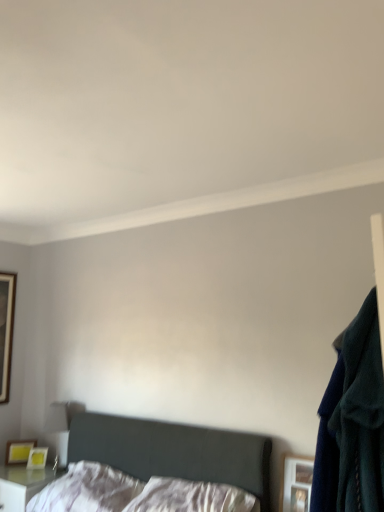
Question: Based on their positions, is white satin pillow at center, arranged as the 1th pillow when viewed from the right, located to the left or right of wooden framed mirror at left, which ranks as the 3th picture frame in bottom-to-top order?

Choices:
 (A) left
 (B) right

Answer: (B)

Question: Considering the positions of white satin pillow at center, arranged as the 1th pillow when viewed from the right, and wooden framed mirror at left, positioned as the first picture frame in left-to-right order, in the image, is white satin pillow at center, arranged as the 1th pillow when viewed from the right, wider or thinner than wooden framed mirror at left, positioned as the first picture frame in left-to-right order,?

Choices:
 (A) thin
 (B) wide

Answer: (B)

Question: Based on their relative distances, which object is nearer to the white glossy nightstand at lower left?

Choices:
 (A) white soft pillow at lower center, the 1th pillow in the left-to-right sequence
 (B) wooden framed mirror at left, which ranks as the 3th picture frame in bottom-to-top order
 (C) dark gray fabric bed at lower left
 (D) wooden picture frame at lower right, marked as the 2th picture frame in a top-to-bottom arrangement
 (E) matte yellow picture frame at lower left, marked as the 3th picture frame in a top-to-bottom arrangement

Answer: (E)

Question: Which object is positioned farthest from the wooden picture frame at lower right, acting as the second picture frame starting from the bottom?

Choices:
 (A) dark gray fabric bed at lower left
 (B) white soft pillow at lower center, arranged as the second pillow when viewed from the right
 (C) navy blue sweater at right
 (D) white satin pillow at center, arranged as the 1th pillow when viewed from the right
 (E) white glossy nightstand at lower left

Answer: (E)